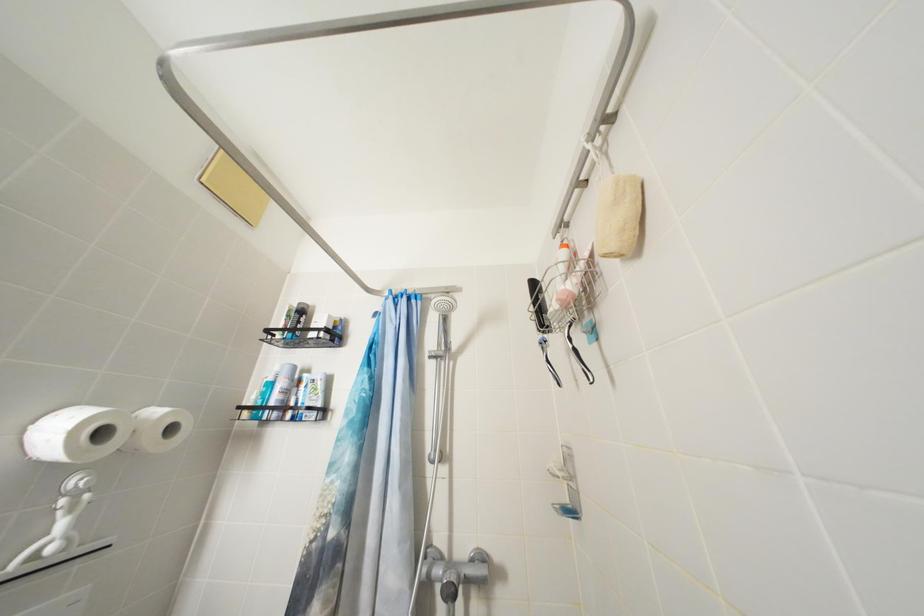
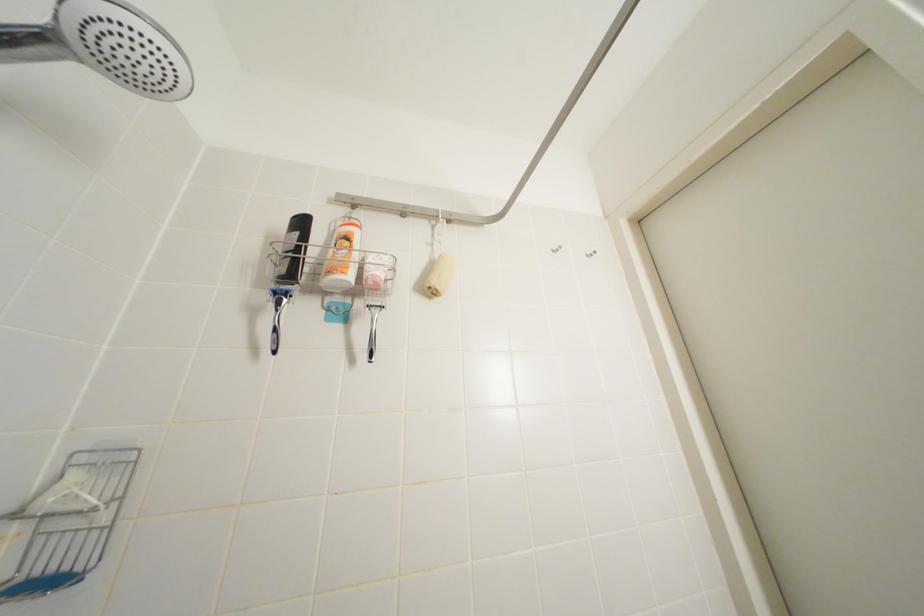
The images are taken continuously from a first-person perspective. In which direction is your viewpoint rotating?

The camera rotated toward right-up.